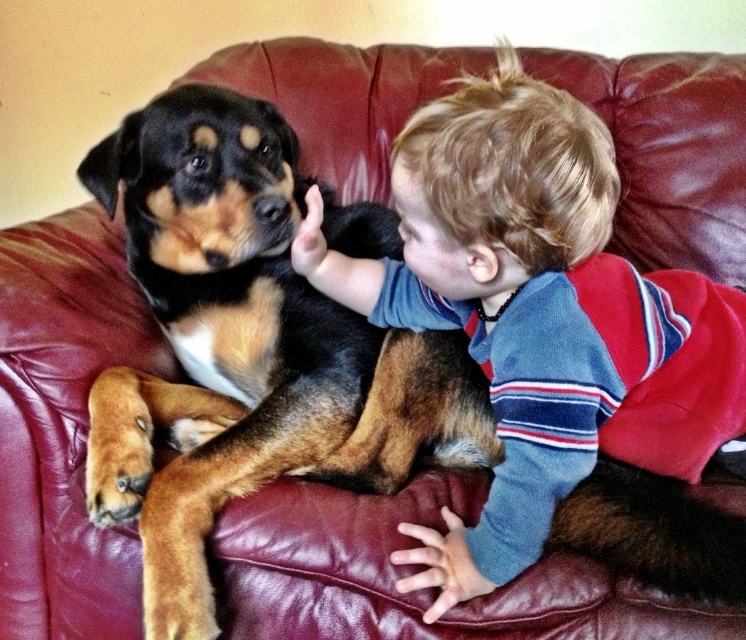
Question: Does brown and black fur at center appear on the left side of smooth blond hair at upper right?

Choices:
 (A) yes
 (B) no

Answer: (A)

Question: Is brown and black fur at center below smooth blond hair at upper right?

Choices:
 (A) no
 (B) yes

Answer: (B)

Question: In this image, where is brown and black fur at center located relative to smooth blond hair at upper right?

Choices:
 (A) below
 (B) above

Answer: (A)

Question: Which object is closer to the camera taking this photo?

Choices:
 (A) smooth blond hair at upper right
 (B) brown and black fur at center

Answer: (A)

Question: Among these objects, which one is farthest from the camera?

Choices:
 (A) brown and black fur at center
 (B) smooth blond hair at upper right

Answer: (A)